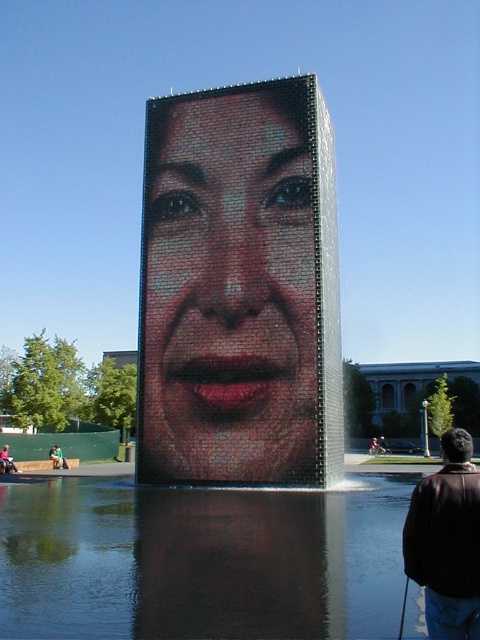
You are a photographer standing at the center of the public square where the art installation is located. You want to capture the smooth mosaic face at center in your photo. Based on the coordinates provided, where should you position your camera relative to the installation to ensure the face is centered in your shot?

The smooth mosaic face at center is located at coordinates point (228, 291). To center it in your photo, position your camera so that the face aligns with the center point of your viewfinder, which corresponds to those coordinates.

You are standing in front of the public art installation and notice the smooth mosaic face at center and the brown leather jacket at lower right. Which object is located to the left of the other?

The smooth mosaic face at center is positioned on the left side of brown leather jacket at lower right.